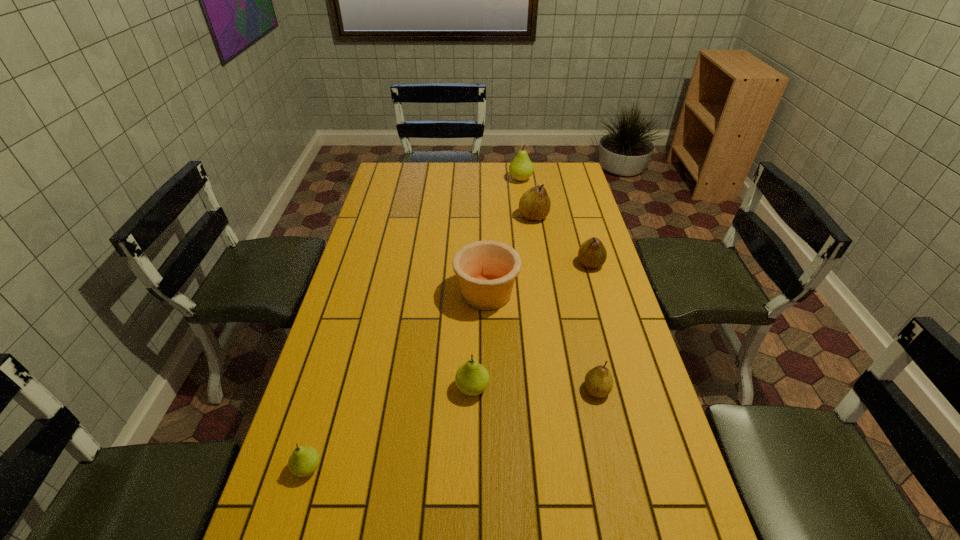
Where is `the leftmost green pear`? The width and height of the screenshot is (960, 540). the leftmost green pear is located at coordinates (304, 460).

Image resolution: width=960 pixels, height=540 pixels. I want to click on the smallest brown pear, so click(598, 381).

I want to click on free region located on the front of the biggest green pear, so click(527, 222).

Identify the location of vacant area situated on the left of the second farthest object. The image size is (960, 540). (x=441, y=217).

Identify the location of vacant space located on the left of the pottery. (349, 293).

Find the location of `vacant space located 0.060m on the left of the fourth nearest pear`. vacant space located 0.060m on the left of the fourth nearest pear is located at coordinates (560, 264).

Identify the location of vacant space situated 0.060m on the left of the second farthest green pear. (433, 388).

Locate an element on the screen. This screenshot has height=540, width=960. vacant area situated 0.200m on the back of the smallest green pear is located at coordinates (333, 382).

I want to click on vacant region located on the left of the smallest brown pear, so click(x=515, y=390).

You are a GUI agent. You are given a task and a screenshot of the screen. Output one action in this format:
    pyautogui.click(x=<x>, y=<y>)
    Task: Click on the object that is at the far edge
    The image size is (960, 540).
    Given the screenshot: What is the action you would take?
    pyautogui.click(x=521, y=168)